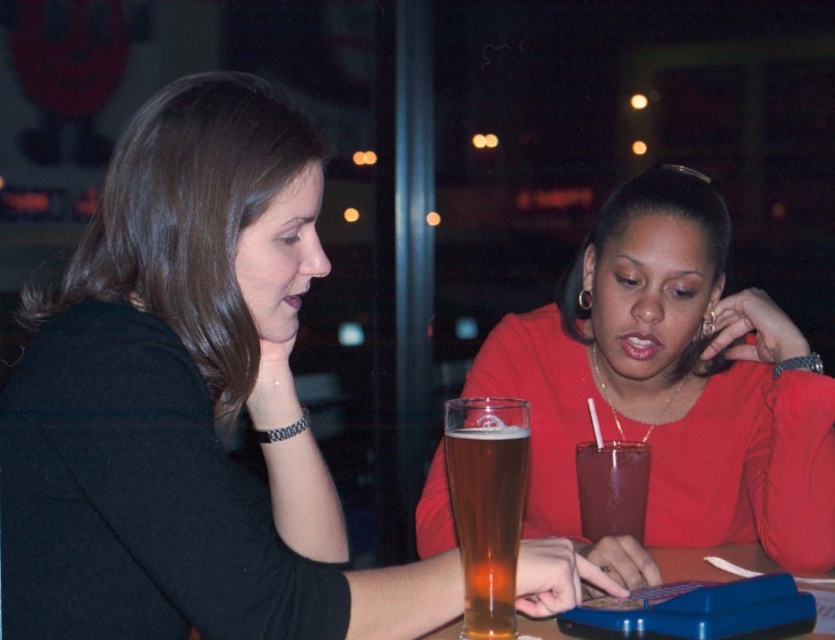
Which is more to the right, matte black shirt at center or golden glass beer at center?

golden glass beer at center is more to the right.

Which is below, matte black shirt at center or golden glass beer at center?

golden glass beer at center

Describe the element at coordinates (186, 403) in the screenshot. I see `matte black shirt at center` at that location.

Locate an element on the screen. The image size is (835, 640). matte black shirt at center is located at coordinates (186, 403).

Which is below, matte red blouse at center or golden glass beer at center?

golden glass beer at center is below.

Locate an element on the screen. matte red blouse at center is located at coordinates (672, 381).

At what (x,y) coordinates should I click in order to perform the action: click on matte red blouse at center. Please return your answer as a coordinate pair (x, y). The image size is (835, 640). Looking at the image, I should click on (672, 381).

Is golden glass beer at center below blue plastic table at center?

Incorrect, golden glass beer at center is not positioned below blue plastic table at center.

Is golden glass beer at center shorter than blue plastic table at center?

No.

Between point (498, 429) and point (726, 560), which one is positioned in front?

Positioned in front is point (498, 429).

Locate an element on the screen. golden glass beer at center is located at coordinates (487, 516).